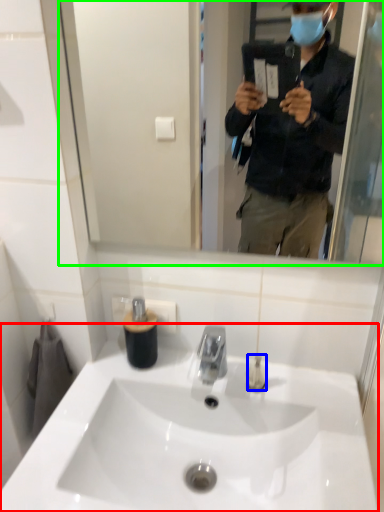
Question: Which is nearer to the sink (highlighted by a red box)? toiletry (highlighted by a blue box) or mirror (highlighted by a green box).

Choices:
 (A) toiletry
 (B) mirror

Answer: (A)